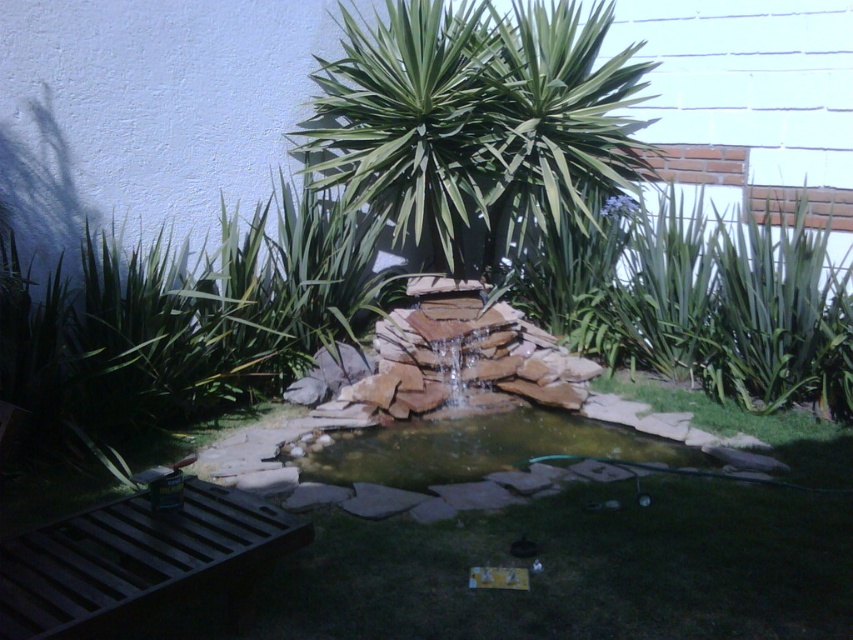
Does green leafy palm tree at center have a lesser height compared to brown stone pond at center?

No.

Which is in front, point (366, 138) or point (665, 445)?

Point (665, 445) is more forward.

In order to click on green leafy palm tree at center in this screenshot , I will do `click(474, 116)`.

At what (x,y) coordinates should I click in order to perform the action: click on green leafy palm tree at center. Please return your answer as a coordinate pair (x, y). Looking at the image, I should click on (474, 116).